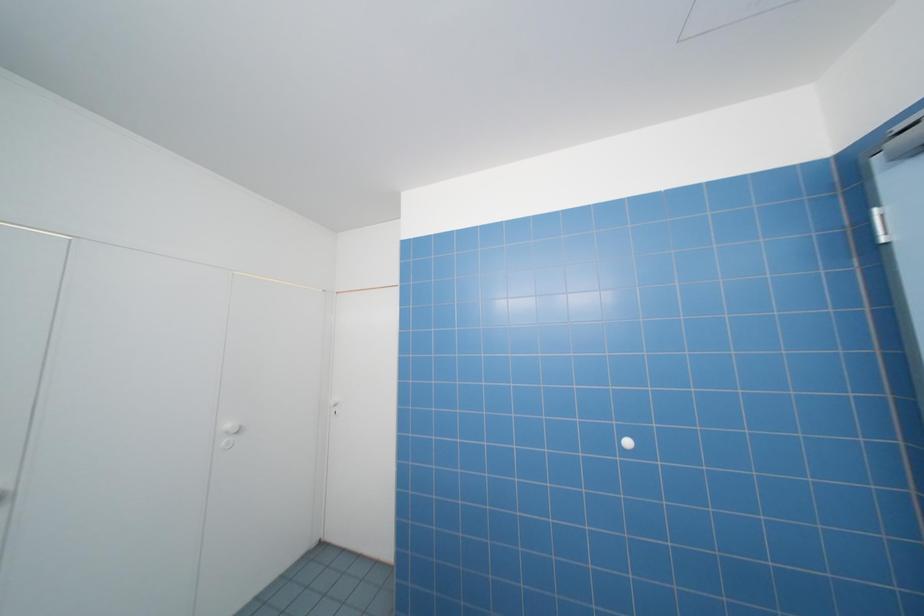
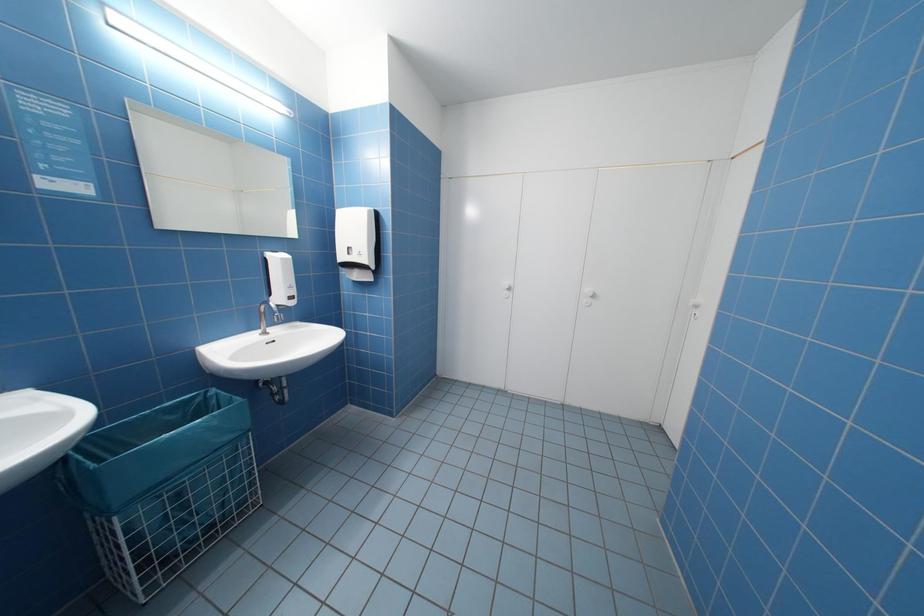
Question: The camera is either moving clockwise (left) or counter-clockwise (right) around the object. The first image is from the beginning of the video and the second image is from the end. Is the camera moving left or right when shooting the video?

Choices:
 (A) Left
 (B) Right

Answer: (B)